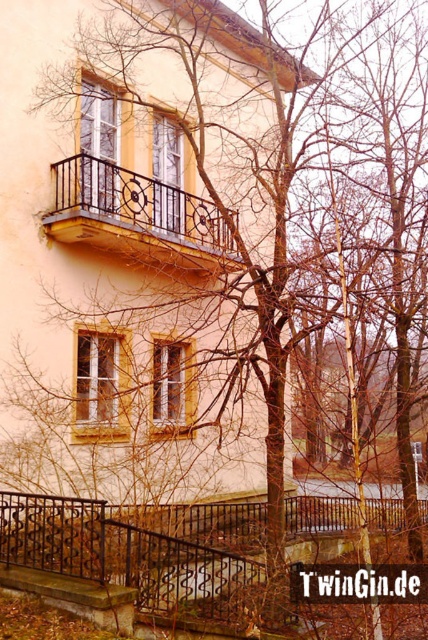
Which is more to the left, matte glass window at center or matte glass window at upper center?

Positioned to the left is matte glass window at center.

Is matte glass window at center closer to camera compared to matte glass window at upper center?

Yes, it is.

Is point (76, 403) farther from camera compared to point (172, 134)?

No, it is in front of (172, 134).

Where is `matte glass window at center`? This screenshot has width=428, height=640. matte glass window at center is located at coordinates (101, 385).

Consider the image. Is black wrought iron railing at lower left in front of wooden textured window at center?

Yes, black wrought iron railing at lower left is in front of wooden textured window at center.

Is point (183, 580) more distant than point (157, 353)?

No, (183, 580) is in front of (157, 353).

Is point (184, 602) less distant than point (187, 388)?

Yes, point (184, 602) is in front of point (187, 388).

Where is `black wrought iron railing at lower left`? The image size is (428, 640). black wrought iron railing at lower left is located at coordinates (142, 548).

Between matte black window at upper left and wooden textured window at center, which one has more height?

With more height is wooden textured window at center.

Can you confirm if matte black window at upper left is thinner than wooden textured window at center?

Indeed, matte black window at upper left has a lesser width compared to wooden textured window at center.

Is point (92, 93) less distant than point (189, 401)?

That is True.

The width and height of the screenshot is (428, 640). I want to click on matte black window at upper left, so [x=98, y=147].